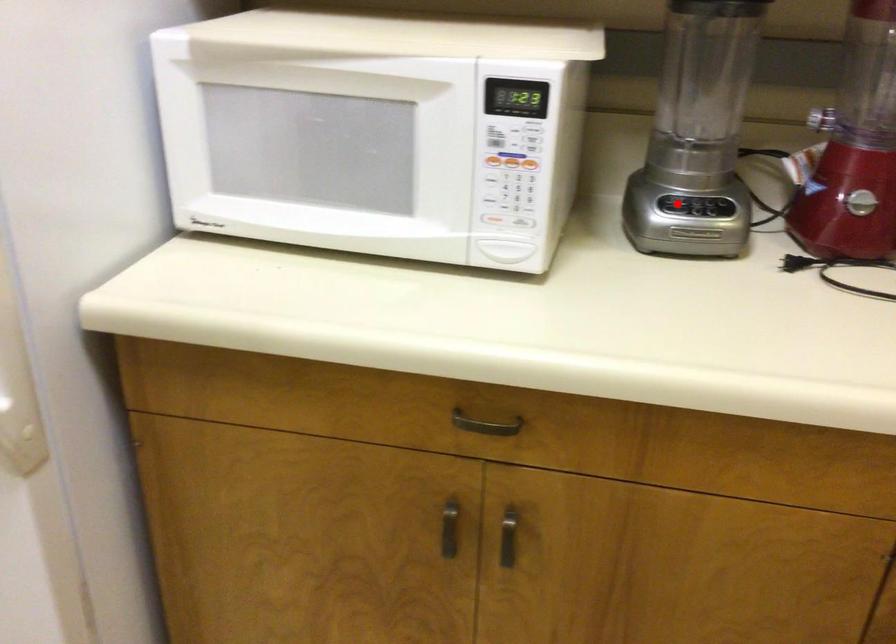
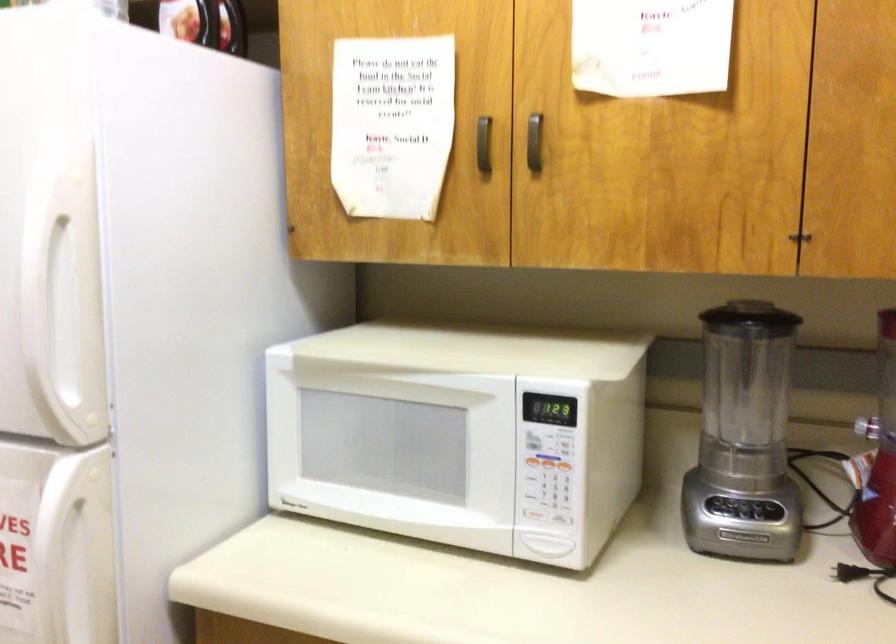
Find the pixel in the second image that matches the highlighted location in the first image.

(725, 506)